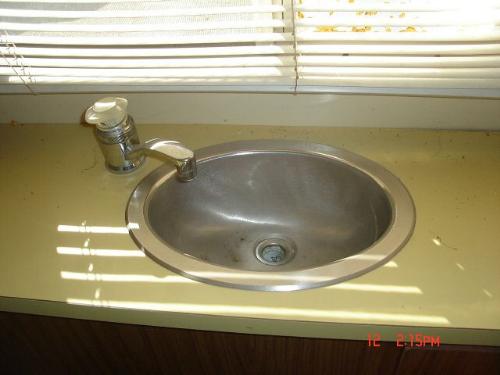
At what (x,y) coordinates should I click in order to perform the action: click on plug hole. Please return your answer as a coordinate pair (x, y). Image resolution: width=500 pixels, height=375 pixels. Looking at the image, I should click on pyautogui.click(x=268, y=254).